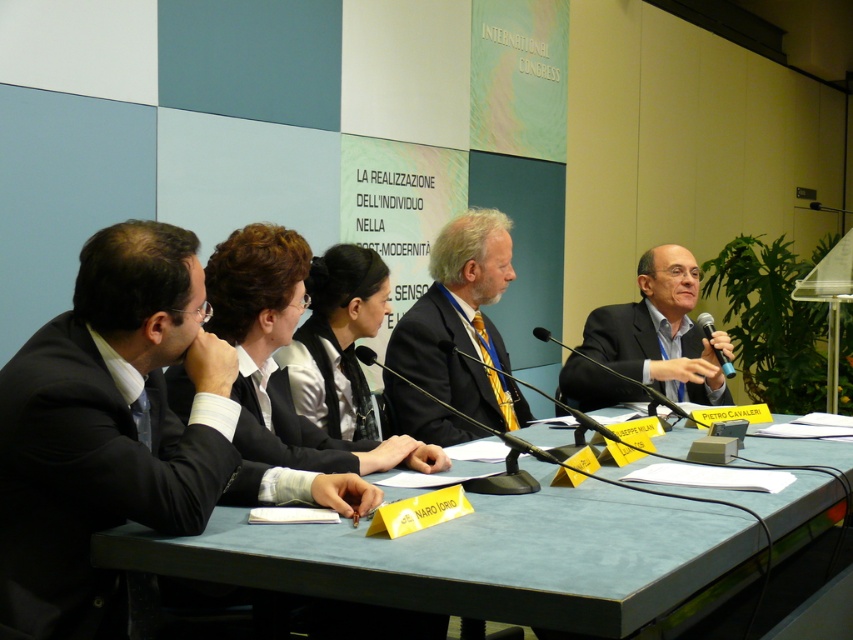
Does white satin blouse at center lie behind black plastic microphone at right?

No, white satin blouse at center is in front of black plastic microphone at right.

Between point (329, 397) and point (730, 371), which one is positioned in front?

Point (329, 397) is more forward.

The width and height of the screenshot is (853, 640). I want to click on white satin blouse at center, so click(x=328, y=381).

Who is positioned more to the left, matte black suit at center or white satin blouse at center?

Positioned to the left is white satin blouse at center.

Can you confirm if matte black suit at center is positioned above white satin blouse at center?

Indeed, matte black suit at center is positioned over white satin blouse at center.

Which is in front, point (448, 412) or point (346, 349)?

Point (448, 412)

Locate an element on the screen. This screenshot has width=853, height=640. matte black suit at center is located at coordinates (442, 356).

Is black satin suit at left closer to the viewer compared to black matte suit at center?

That is True.

Who is positioned more to the right, black satin suit at left or black matte suit at center?

black matte suit at center

Which is behind, point (62, 509) or point (607, 364)?

Positioned behind is point (607, 364).

The width and height of the screenshot is (853, 640). I want to click on black satin suit at left, so click(90, 481).